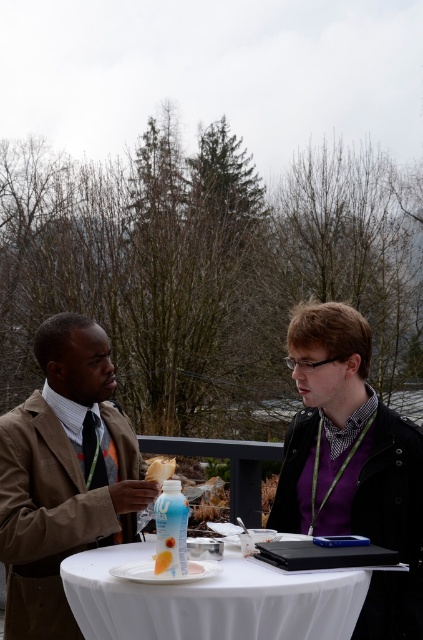
Question: Among these points, which one is nearest to the camera?

Choices:
 (A) (164, 563)
 (B) (323, 577)

Answer: (B)

Question: Which point is closer to the camera taking this photo?

Choices:
 (A) (164, 557)
 (B) (346, 589)

Answer: (A)

Question: Which object appears farthest from the camera in this image?

Choices:
 (A) yellow matte cupcake at center
 (B) brown leather jacket at left

Answer: (B)

Question: Can you confirm if white cloth-covered table at center is wider than white matte cake at center?

Choices:
 (A) no
 (B) yes

Answer: (B)

Question: Can you confirm if white cloth-covered table at center is positioned above yellow matte cupcake at center?

Choices:
 (A) yes
 (B) no

Answer: (B)

Question: Can you confirm if brown leather jacket at left is wider than matte plastic bottle at table center?

Choices:
 (A) yes
 (B) no

Answer: (A)